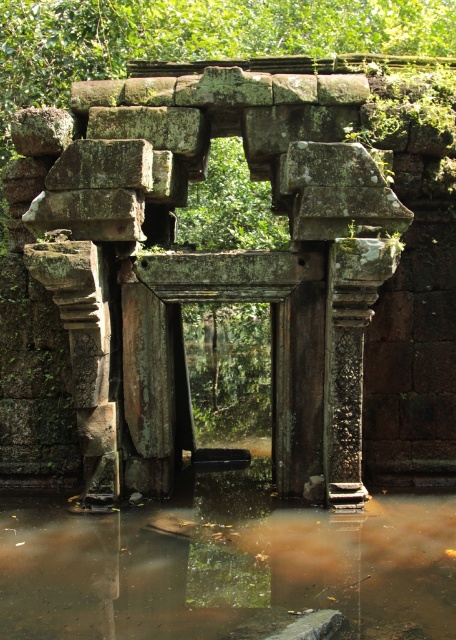
Question: Which point is farther to the camera?

Choices:
 (A) green mossy stone arch at center
 (B) brown murky water at center

Answer: (A)

Question: Which of the following is the closest to the observer?

Choices:
 (A) (83, 208)
 (B) (242, 557)

Answer: (B)

Question: Can you confirm if green mossy stone arch at center is thinner than brown murky water at center?

Choices:
 (A) yes
 (B) no

Answer: (B)

Question: Does green mossy stone arch at center have a greater width compared to brown murky water at center?

Choices:
 (A) no
 (B) yes

Answer: (B)

Question: Is green mossy stone arch at center positioned at the back of brown murky water at center?

Choices:
 (A) no
 (B) yes

Answer: (B)